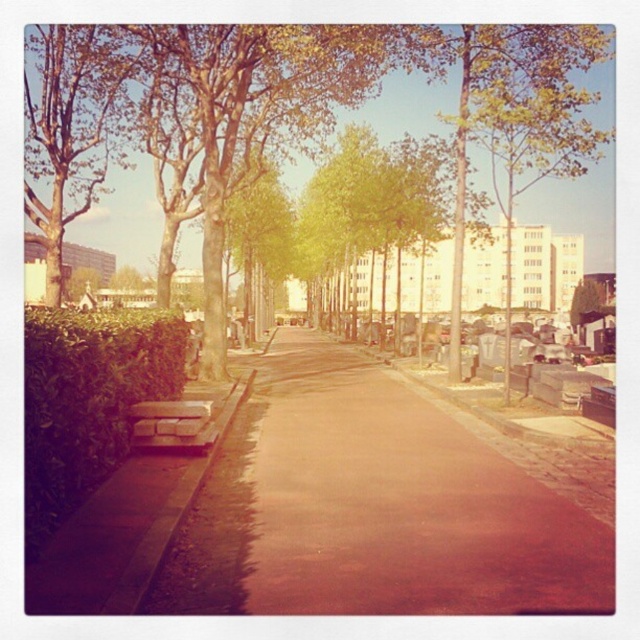
Question: Among these points, which one is nearest to the camera?

Choices:
 (A) (150, 339)
 (B) (339, 572)

Answer: (B)

Question: From the image, what is the correct spatial relationship of green leafy hedge at lower left in relation to green leafy tree at upper left?

Choices:
 (A) left
 (B) right

Answer: (B)

Question: Which point is farther to the camera?

Choices:
 (A) wooden park bench at lower left
 (B) green leafy hedge at lower left
 (C) green leafy tree at upper center

Answer: (C)

Question: Does green leafy tree at upper center have a larger size compared to wooden park bench at lower left?

Choices:
 (A) no
 (B) yes

Answer: (B)

Question: Which object is farther from the camera taking this photo?

Choices:
 (A) brown asphalt pavement at center
 (B) green leafy tree at upper center

Answer: (B)

Question: Is the position of green leafy tree at upper left more distant than that of wooden park bench at lower left?

Choices:
 (A) no
 (B) yes

Answer: (B)